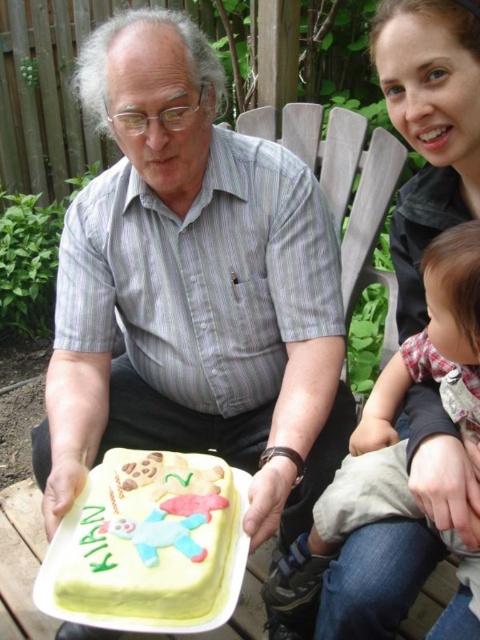
Can you confirm if yellow fondant cake at center is positioned above fluffy pink fabric at lower right?

Indeed, yellow fondant cake at center is positioned over fluffy pink fabric at lower right.

Is yellow fondant cake at center wider than fluffy pink fabric at lower right?

No.

Measure the distance between yellow fondant cake at center and camera.

yellow fondant cake at center is 26.52 inches away from camera.

Identify the location of yellow fondant cake at center. Image resolution: width=480 pixels, height=640 pixels. (149, 540).

Can you confirm if matte yellow cake at center is positioned to the left of matte black shirt at upper center?

Correct, you'll find matte yellow cake at center to the left of matte black shirt at upper center.

Which is in front, point (117, 132) or point (391, 548)?

Point (391, 548) is more forward.

Where is `matte yellow cake at center`? Image resolution: width=480 pixels, height=640 pixels. matte yellow cake at center is located at coordinates click(x=192, y=289).

Is matte yellow cake at center to the right of yellow fondant cake at center from the viewer's perspective?

Yes, matte yellow cake at center is to the right of yellow fondant cake at center.

Between point (312, 493) and point (227, 531), which one is positioned behind?

The point (312, 493) is more distant.

Where is `matte yellow cake at center`? matte yellow cake at center is located at coordinates (192, 289).